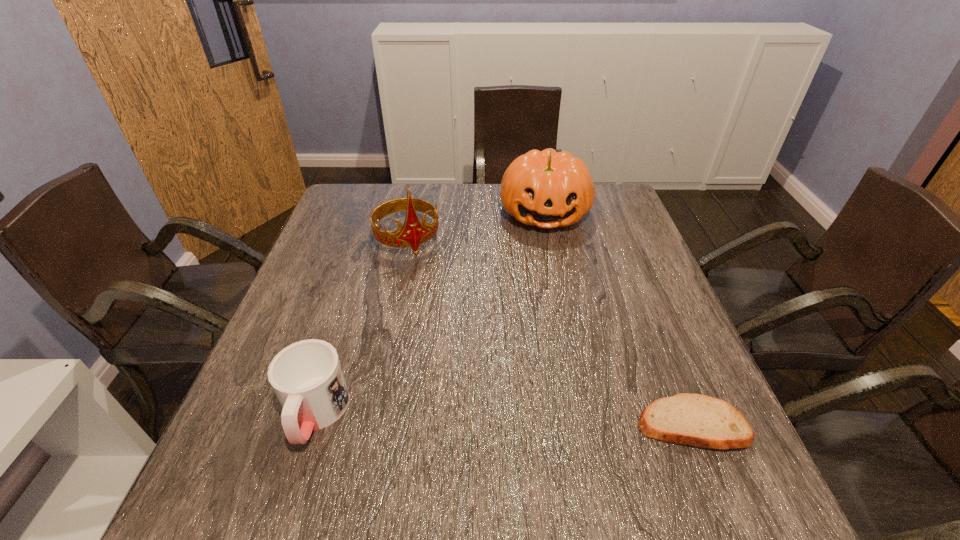
This screenshot has width=960, height=540. I want to click on vacant area that lies between the shortest object and the tiara, so click(550, 332).

At what (x,y) coordinates should I click in order to perform the action: click on unoccupied area between the second shortest object and the shortest object. Please return your answer as a coordinate pair (x, y). Image resolution: width=960 pixels, height=540 pixels. Looking at the image, I should click on (504, 419).

Find the location of a particular element. The width and height of the screenshot is (960, 540). free spot between the second shortest object and the pumpkin is located at coordinates (430, 313).

You are a GUI agent. You are given a task and a screenshot of the screen. Output one action in this format:
    pyautogui.click(x=<x>, y=<y>)
    Task: Click on the free space between the pita bread and the third tallest object
    The width and height of the screenshot is (960, 540).
    Given the screenshot: What is the action you would take?
    pyautogui.click(x=504, y=419)

I want to click on vacant space that's between the mug and the tiara, so click(361, 327).

The image size is (960, 540). What are the coordinates of `vacant point located between the pita bread and the third shortest object` in the screenshot? It's located at (618, 318).

I want to click on free point between the tiara and the mug, so click(x=361, y=327).

Locate an element on the screen. vacant area that lies between the pita bread and the second tallest object is located at coordinates (618, 318).

Identify the location of vacant space that's between the tiara and the third shortest object. (x=476, y=226).

Where is `object that is the third closest one to the tiara`? This screenshot has height=540, width=960. object that is the third closest one to the tiara is located at coordinates coord(692,419).